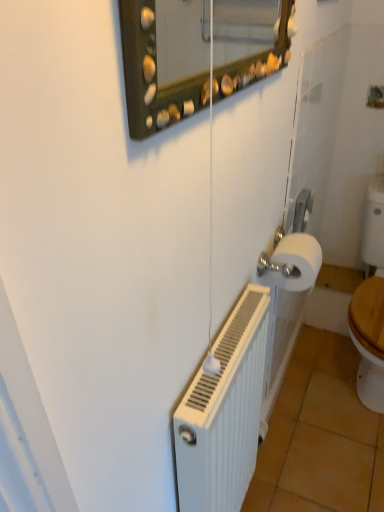
Locate an element on the screen. free point above orange tile at lower right (from a real-world perspective) is located at coordinates (323, 426).